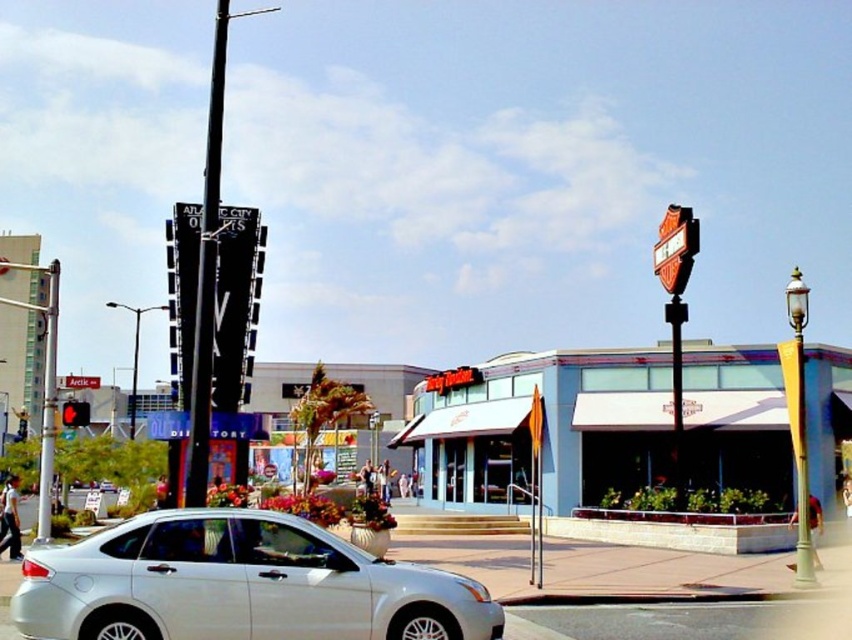
Question: Does white glossy sedan at lower left come behind black metal pole at upper left?

Choices:
 (A) yes
 (B) no

Answer: (B)

Question: Which object is closer to the camera taking this photo?

Choices:
 (A) metallic traffic light at left
 (B) black metal pole at upper left
 (C) red glass traffic light at left

Answer: (B)

Question: Can you confirm if metallic traffic light at left is positioned below red glass traffic light at left?

Choices:
 (A) yes
 (B) no

Answer: (A)

Question: Which of these objects is positioned closest to the metallic traffic light at left?

Choices:
 (A) black metal pole at upper left
 (B) red glass traffic light at left
 (C) white glossy sedan at lower left

Answer: (C)

Question: Which of the following is the farthest from the observer?

Choices:
 (A) metallic traffic light at left
 (B) red glass traffic light at left
 (C) white glossy sedan at lower left
 (D) black metal pole at upper left

Answer: (B)

Question: Is white glossy sedan at lower left thinner than black metal pole at upper left?

Choices:
 (A) yes
 (B) no

Answer: (A)